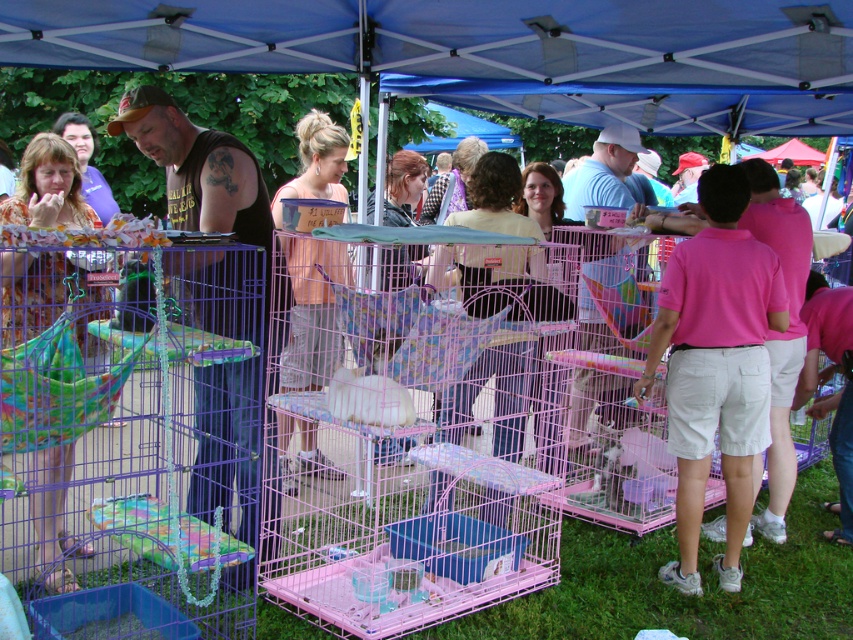
Question: Which point is farther to the camera?

Choices:
 (A) (57, 449)
 (B) (679, 390)
 (C) (234, 298)
 (D) (305, 369)

Answer: (D)

Question: Based on their relative distances, which object is farther from the pink fabric dress at center?

Choices:
 (A) black tank top at left
 (B) pink cotton shirt at right

Answer: (B)

Question: Does pink cotton shirt at right appear over black tank top at left?

Choices:
 (A) no
 (B) yes

Answer: (A)

Question: Can you confirm if floral dress at left is positioned above pink fabric dress at center?

Choices:
 (A) no
 (B) yes

Answer: (B)

Question: Among these objects, which one is farthest from the camera?

Choices:
 (A) floral dress at left
 (B) black tank top at left

Answer: (A)

Question: Is the position of floral dress at left more distant than that of pink fabric dress at center?

Choices:
 (A) no
 (B) yes

Answer: (A)